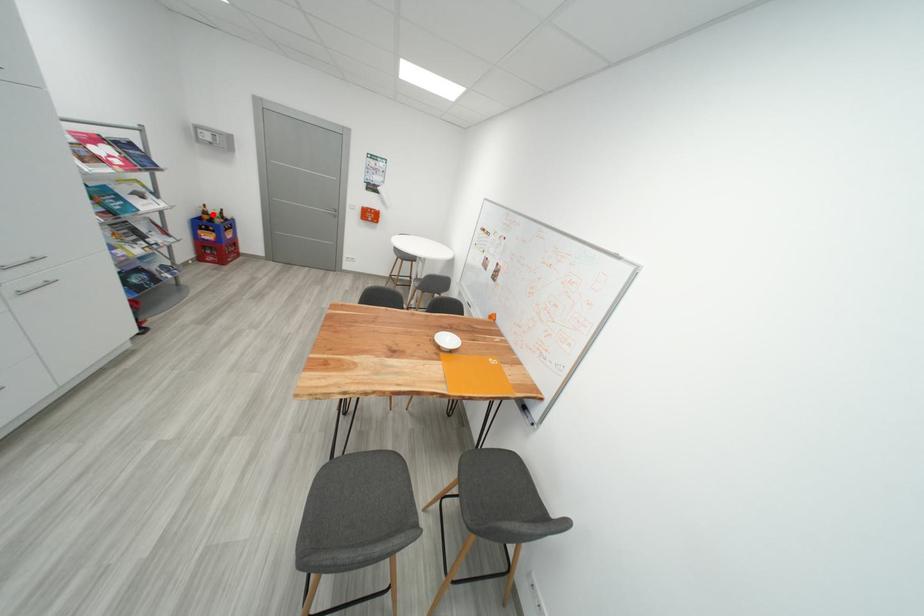
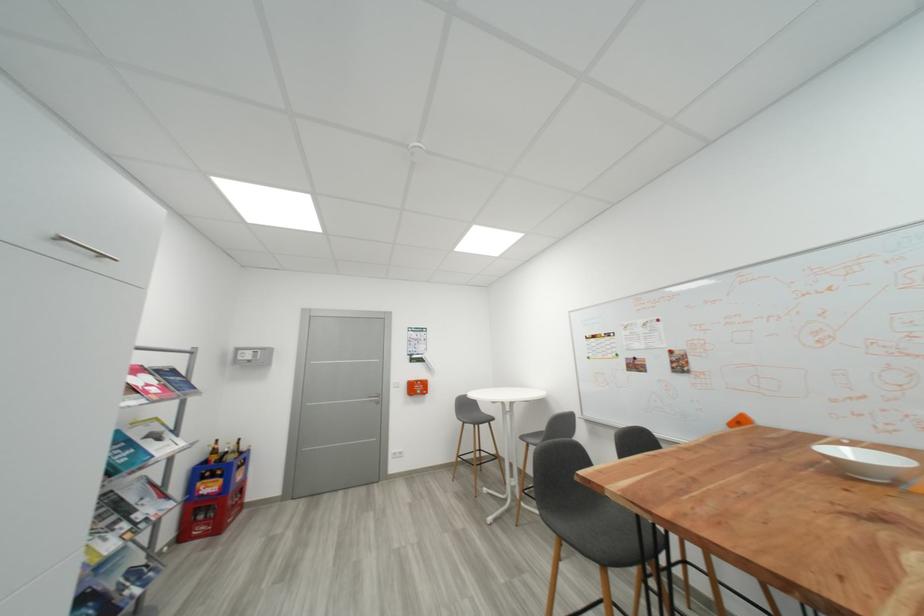
Where in the second image is the point corresponding to the highlighted location from the first image?

(223, 454)